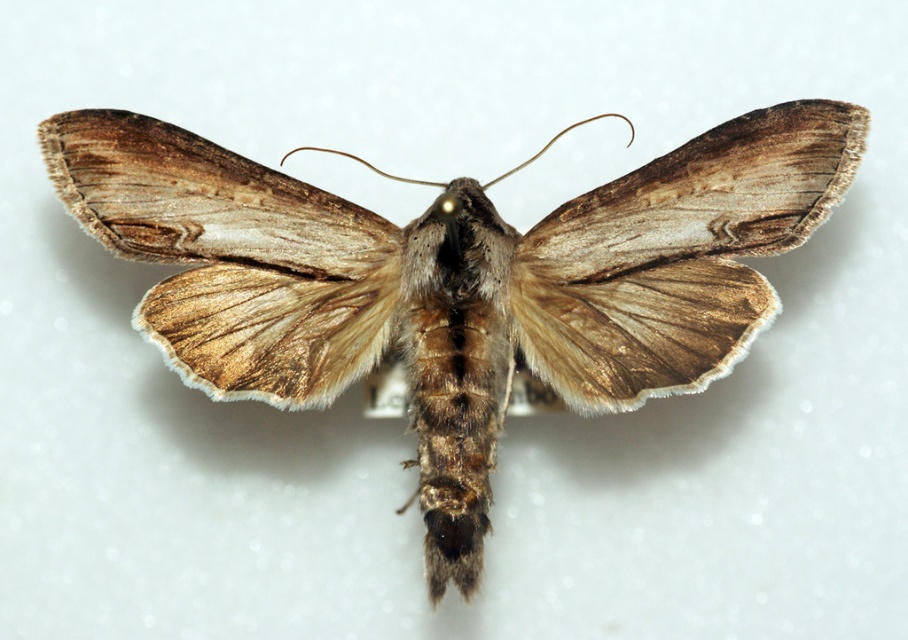
Which is in front, point (630, 250) or point (796, 122)?

Point (796, 122) is more forward.

Does brown textured moth at center have a lesser width compared to brown fuzzy moth wing at center?

No, brown textured moth at center is not thinner than brown fuzzy moth wing at center.

Does point (374, 234) lie behind point (746, 333)?

Yes.

I want to click on brown textured moth at center, so click(455, 280).